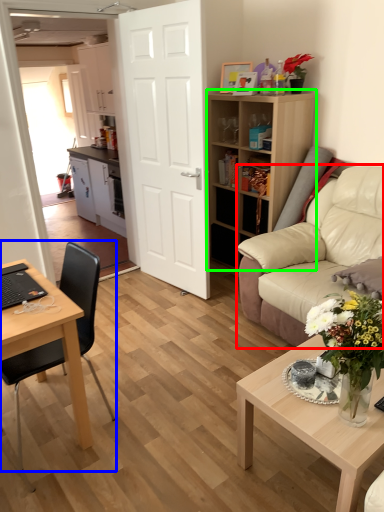
Question: Which object is the closest to the studio couch (highlighted by a red box)? Choose among these: chair (highlighted by a blue box) or shelf (highlighted by a green box).

Choices:
 (A) chair
 (B) shelf

Answer: (B)